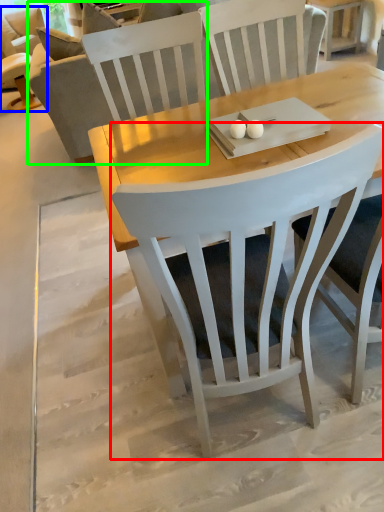
Question: Estimate the real-world distances between objects in this image. Which object is farther from chair (highlighted by a red box), chair (highlighted by a blue box) or couch (highlighted by a green box)?

Choices:
 (A) chair
 (B) couch

Answer: (A)